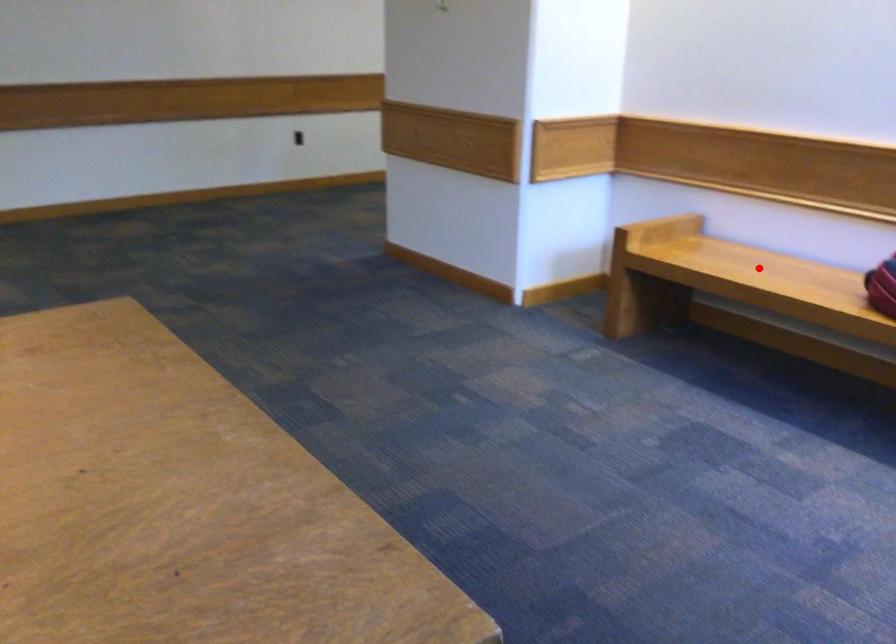
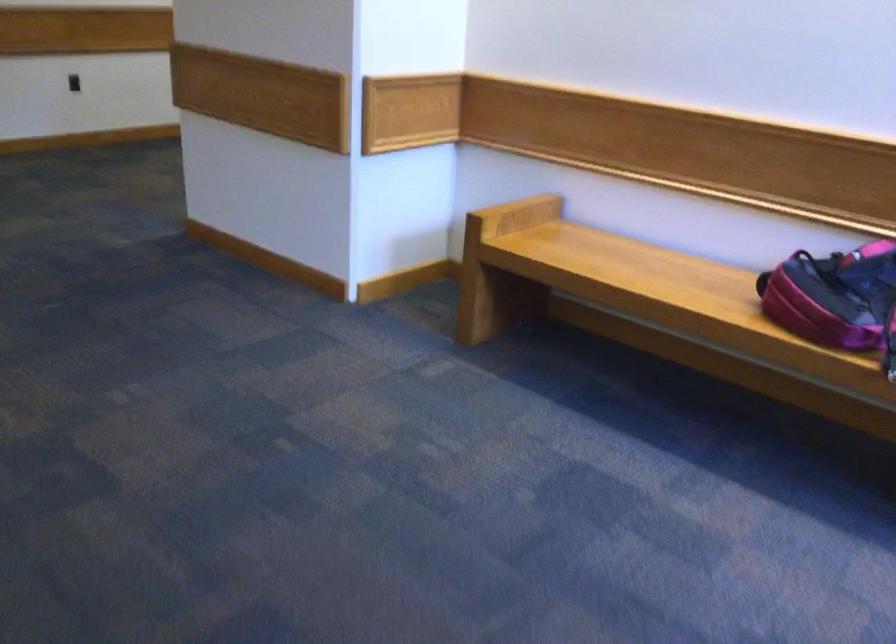
Question: I am providing you with two images of the same scene from different viewpoints. A red point is shown in image1. For the corresponding object point in image2, is it positioned nearer or farther from the camera?

Choices:
 (A) Nearer
 (B) Farther

Answer: (A)